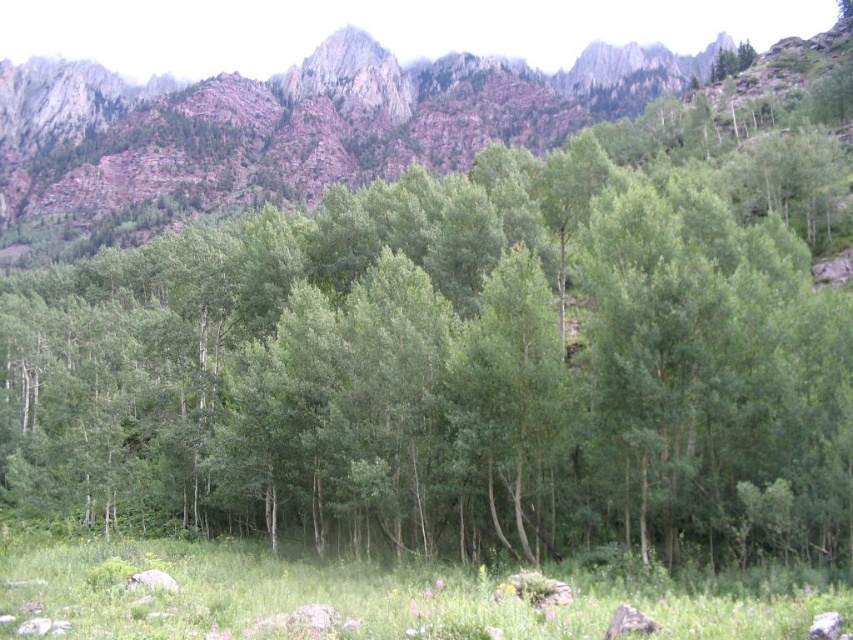
Is rustic rock mountain at upper center taller than green grassy field at lower center?

Correct, rustic rock mountain at upper center is much taller as green grassy field at lower center.

Does rustic rock mountain at upper center appear under green grassy field at lower center?

Actually, rustic rock mountain at upper center is above green grassy field at lower center.

You are a GUI agent. You are given a task and a screenshot of the screen. Output one action in this format:
    pyautogui.click(x=<x>, y=<y>)
    Task: Click on the rustic rock mountain at upper center
    
    Given the screenshot: What is the action you would take?
    pyautogui.click(x=287, y=129)

Find the location of a particular element. rustic rock mountain at upper center is located at coordinates (287, 129).